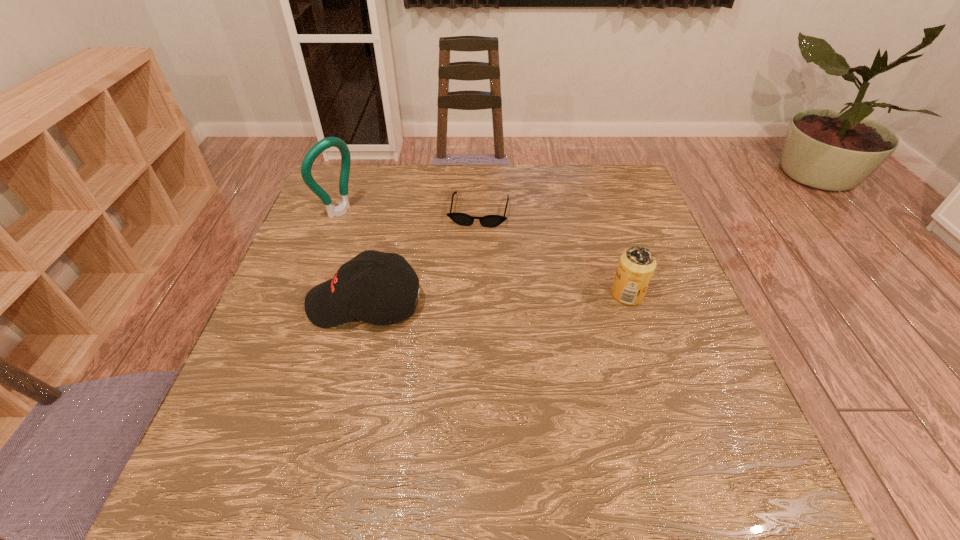
Where is `baseball cap`? Image resolution: width=960 pixels, height=540 pixels. baseball cap is located at coordinates (348, 296).

This screenshot has height=540, width=960. Identify the location of beer can. (636, 267).

Identify the location of the tallest object. The height and width of the screenshot is (540, 960). (341, 209).

Where is `sunglasses`? The image size is (960, 540). sunglasses is located at coordinates (490, 221).

Locate an element on the screen. This screenshot has width=960, height=540. the third object from left to right is located at coordinates (490, 221).

Find the location of a particular element. The height and width of the screenshot is (540, 960). blank area located 0.090m on the front-facing side of the baseball cap is located at coordinates (269, 303).

You are a GUI agent. You are given a task and a screenshot of the screen. Output one action in this format:
    pyautogui.click(x=<x>, y=<y>)
    Task: Click on the free point located on the front-facing side of the baseball cap
    The height and width of the screenshot is (540, 960).
    Given the screenshot: What is the action you would take?
    pyautogui.click(x=282, y=303)

This screenshot has width=960, height=540. In order to click on free space located on the front of the beer can in this screenshot , I will do tap(670, 427).

This screenshot has width=960, height=540. I want to click on free spot located 0.230m at the jaws of the tallest object, so click(x=409, y=254).

Identify the location of free space located 0.080m at the jaws of the tallest object. The height and width of the screenshot is (540, 960). click(x=370, y=231).